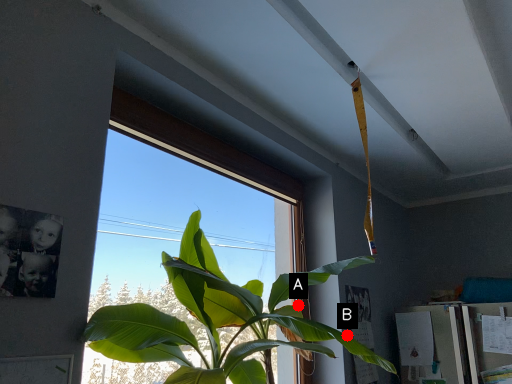
Question: Two points are circled on the image, labeled by A and B beside each circle. Which point is closer to the camera taking this photo?

Choices:
 (A) A is closer
 (B) B is closer

Answer: (B)